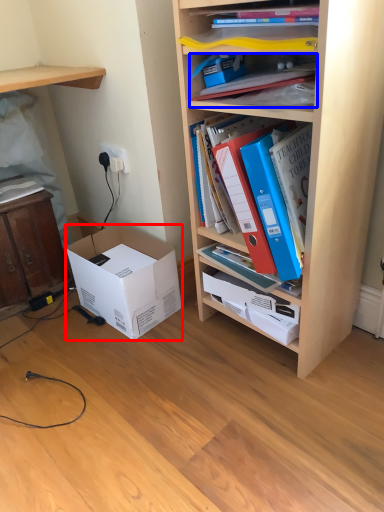
Question: Which object appears closest to the camera in this image, box (highlighted by a red box) or book (highlighted by a blue box)?

Choices:
 (A) box
 (B) book

Answer: (B)